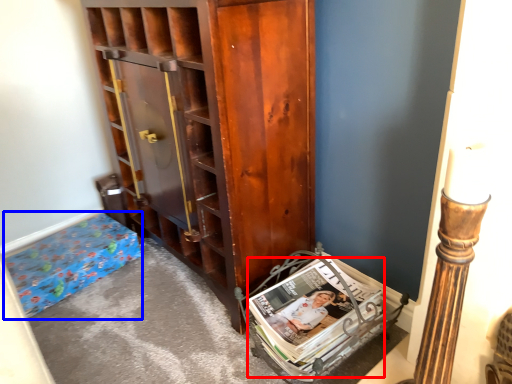
Question: Which point is further to the camera, magazine (highlighted by a red box) or furniture (highlighted by a blue box)?

Choices:
 (A) magazine
 (B) furniture

Answer: (B)